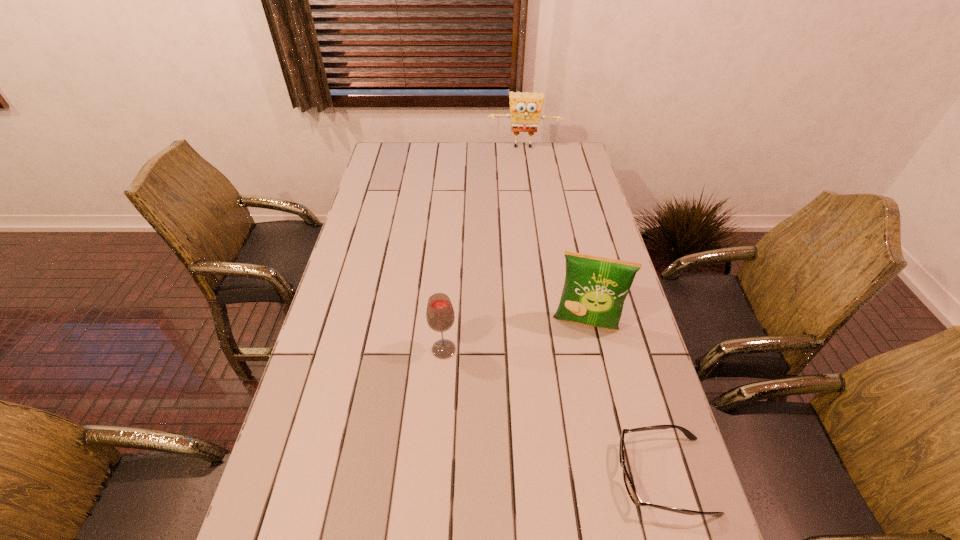
This screenshot has height=540, width=960. Identify the location of vacant space on the desktop that is between the glass drink container and the shortest object and is positioned on the face of the farthest object. (527, 397).

The image size is (960, 540). I want to click on vacant space on the desktop that is between the second shortest object and the shortest object and is positioned on the front-facing side of the crisp (potato chip), so click(x=573, y=423).